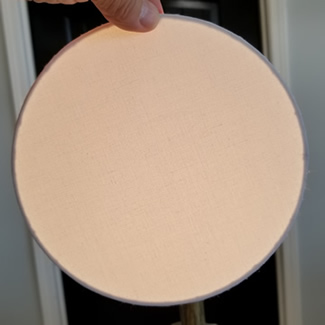
Locate an element on the screen. doorway is located at coordinates [x=264, y=5].